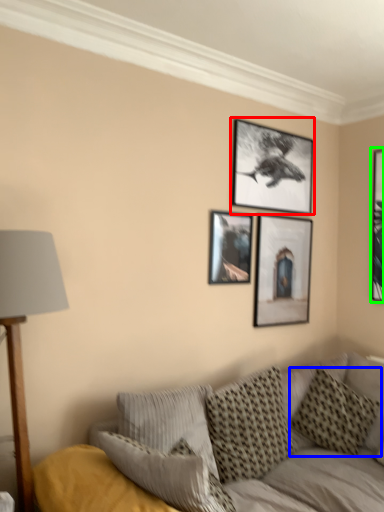
Question: Which object is positioned farthest from picture frame (highlighted by a red box)? Select from pillow (highlighted by a blue box) and picture frame (highlighted by a green box).

Choices:
 (A) pillow
 (B) picture frame

Answer: (A)